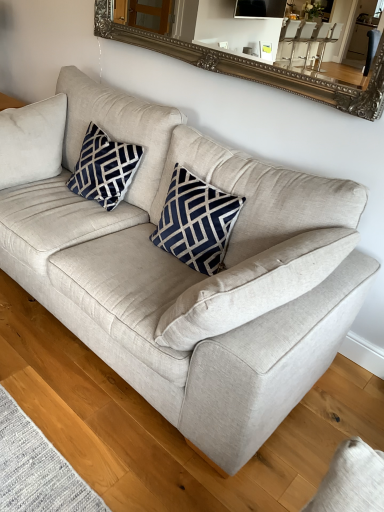
Question: Is silver ornate mirror at upper center taller than navy velvet pillow at upper left?

Choices:
 (A) no
 (B) yes

Answer: (A)

Question: Can you confirm if silver ornate mirror at upper center is bigger than navy velvet pillow at upper left?

Choices:
 (A) no
 (B) yes

Answer: (B)

Question: From a real-world perspective, is silver ornate mirror at upper center positioned over navy velvet pillow at upper left based on gravity?

Choices:
 (A) yes
 (B) no

Answer: (A)

Question: Does silver ornate mirror at upper center have a lesser height compared to navy velvet pillow at upper left?

Choices:
 (A) yes
 (B) no

Answer: (A)

Question: Is silver ornate mirror at upper center oriented towards navy velvet pillow at upper left?

Choices:
 (A) no
 (B) yes

Answer: (A)

Question: In terms of size, does navy blue textured pillow at center appear bigger or smaller than navy velvet pillow at upper left?

Choices:
 (A) big
 (B) small

Answer: (A)

Question: Is navy blue textured pillow at center inside or outside of navy velvet pillow at upper left?

Choices:
 (A) inside
 (B) outside

Answer: (B)

Question: In the image, is navy blue textured pillow at center positioned in front of or behind navy velvet pillow at upper left?

Choices:
 (A) behind
 (B) front

Answer: (B)

Question: Is navy blue textured pillow at center to the left or to the right of navy velvet pillow at upper left in the image?

Choices:
 (A) left
 (B) right

Answer: (B)

Question: In terms of size, does silver ornate mirror at upper center appear bigger or smaller than navy velvet pillow at upper left?

Choices:
 (A) small
 (B) big

Answer: (B)

Question: Is silver ornate mirror at upper center wider or thinner than navy velvet pillow at upper left?

Choices:
 (A) wide
 (B) thin

Answer: (B)

Question: Is point (306, 86) closer or farther from the camera than point (94, 124)?

Choices:
 (A) farther
 (B) closer

Answer: (B)

Question: Visually, is silver ornate mirror at upper center positioned to the left or to the right of navy velvet pillow at upper left?

Choices:
 (A) right
 (B) left

Answer: (A)

Question: Is silver ornate mirror at upper center inside or outside of navy blue textured pillow at center?

Choices:
 (A) inside
 (B) outside

Answer: (B)

Question: From a real-world perspective, is silver ornate mirror at upper center positioned above or below navy blue textured pillow at center?

Choices:
 (A) above
 (B) below

Answer: (A)